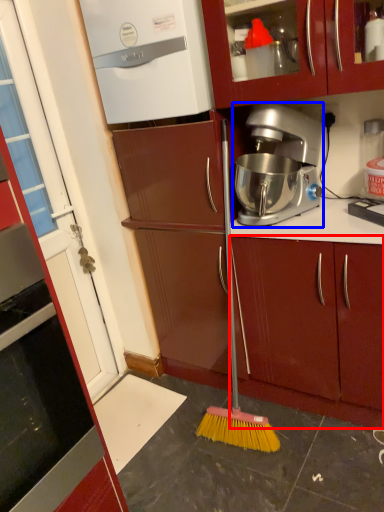
Question: Which point is further to the camera, cabinetry (highlighted by a red box) or coffee maker (highlighted by a blue box)?

Choices:
 (A) cabinetry
 (B) coffee maker

Answer: (A)